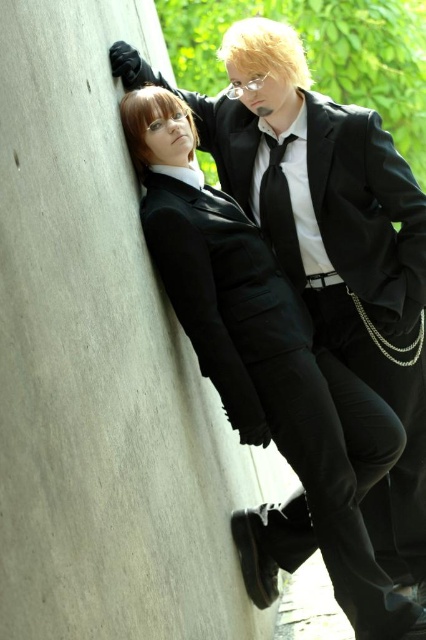
Question: Among these objects, which one is farthest from the camera?

Choices:
 (A) black satin tie at center
 (B) matte black suit at center

Answer: (A)

Question: Which is nearer to the matte black suit at center?

Choices:
 (A) gray concrete wall at left
 (B) black satin tie at center

Answer: (B)

Question: Estimate the real-world distances between objects in this image. Which object is farther from the black satin tie at center?

Choices:
 (A) gray concrete wall at left
 (B) matte black suit at center

Answer: (A)

Question: Is matte black suit at center wider than black satin tie at center?

Choices:
 (A) no
 (B) yes

Answer: (B)

Question: Can you confirm if gray concrete wall at left is positioned to the left of black satin tie at center?

Choices:
 (A) no
 (B) yes

Answer: (B)

Question: Does matte black suit at center appear on the right side of black satin tie at center?

Choices:
 (A) yes
 (B) no

Answer: (A)